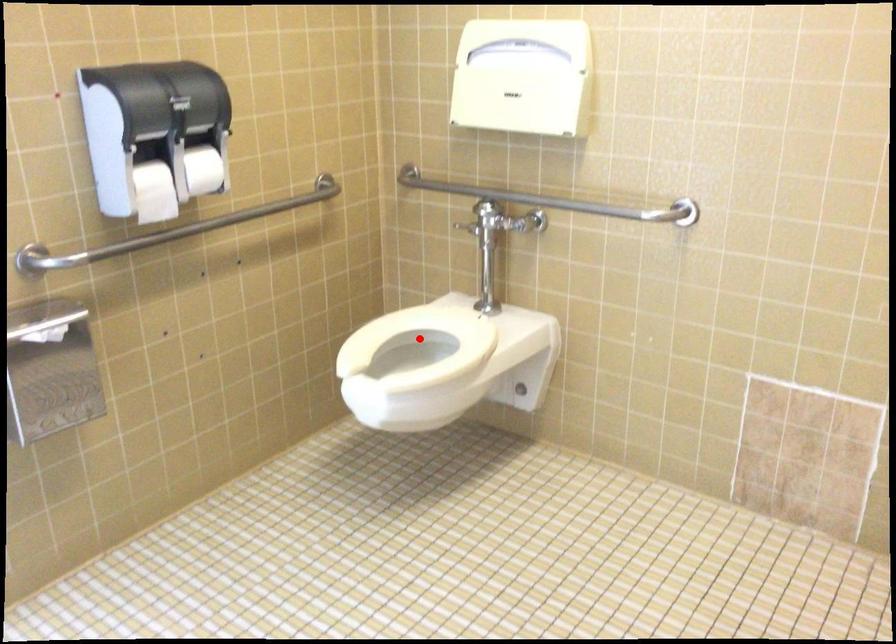
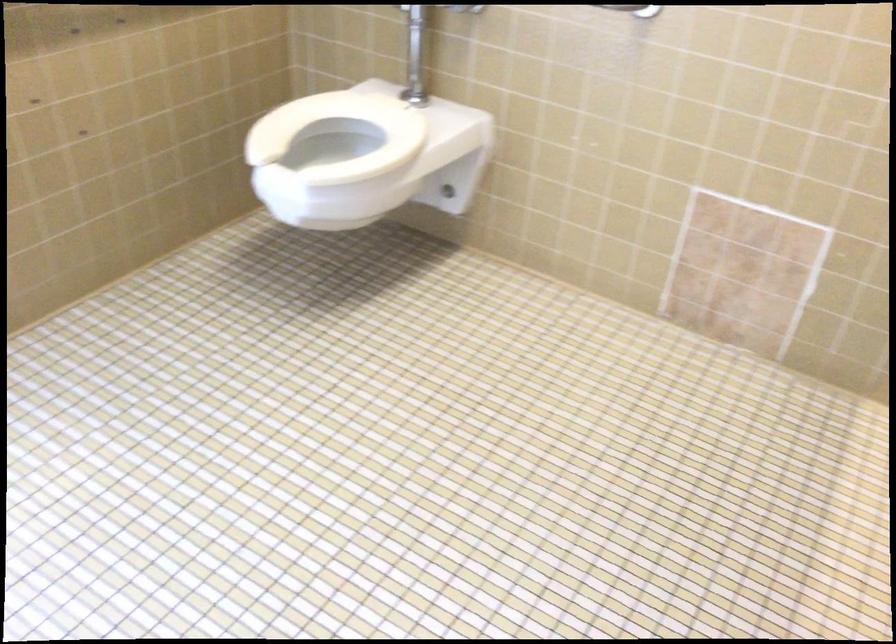
Question: A red point is marked in image1. In image2, is the corresponding 3D point closer to the camera or farther? Reply with the corresponding letter.

Choices:
 (A) The corresponding 3D point is closer.
 (B) The corresponding 3D point is farther.

Answer: (A)